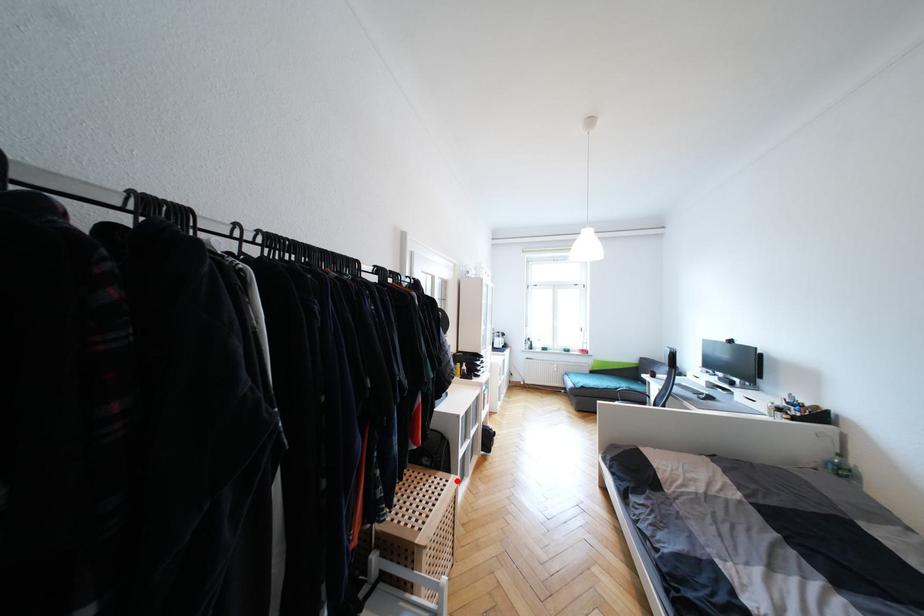
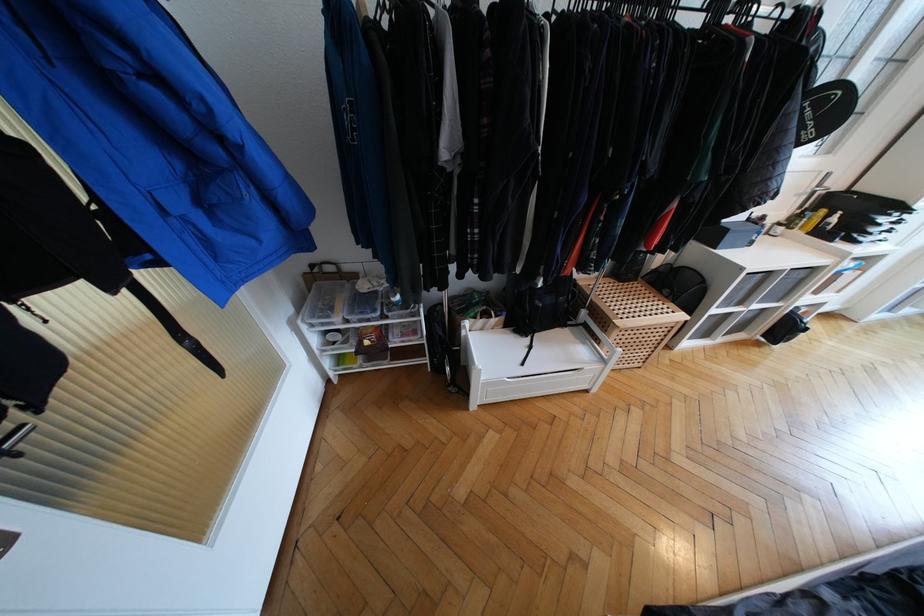
Question: I am providing you with two images of the same scene from different viewpoints. A red point is marked on the first image. At the location where the point appears in image 1, is it still visible in image 2?

Choices:
 (A) Yes
 (B) No

Answer: (A)